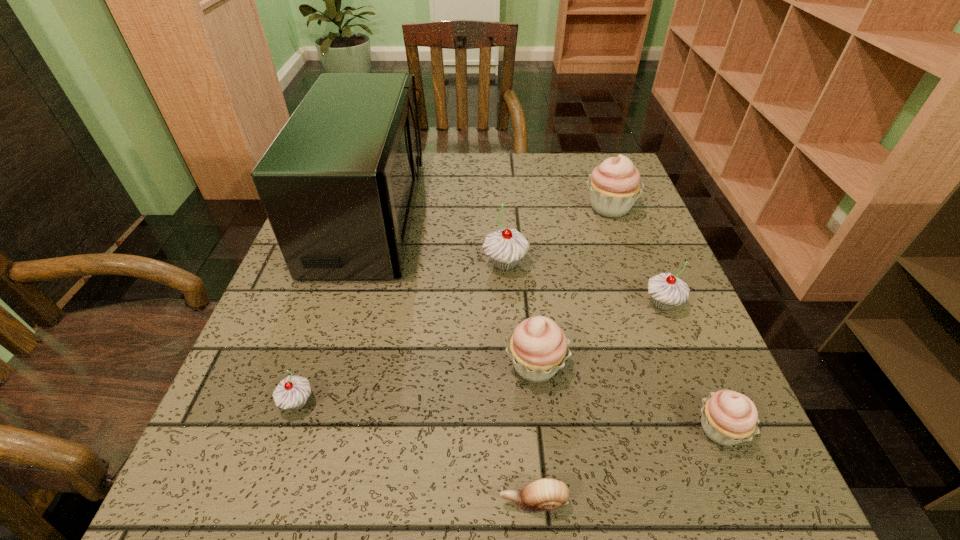
What are the coordinates of `object located at the far left corner` in the screenshot? It's located at (338, 184).

Find the location of a particular element. object at the far right corner is located at coordinates (614, 185).

The image size is (960, 540). In order to click on free space at the far edge of the desktop in this screenshot , I will do `click(486, 166)`.

Locate an element on the screen. This screenshot has height=540, width=960. free point at the left edge is located at coordinates (287, 287).

Where is `free space at the right edge`? This screenshot has height=540, width=960. free space at the right edge is located at coordinates (693, 359).

Image resolution: width=960 pixels, height=540 pixels. In the image, there is a desktop. In order to click on free space at the near left corner in this screenshot , I will do `click(228, 477)`.

Identify the location of free region at the far right corner. Image resolution: width=960 pixels, height=540 pixels. click(591, 168).

Image resolution: width=960 pixels, height=540 pixels. Identify the location of vacant space at the near right corner of the desktop. (691, 468).

Where is `blank region between the second smallest pink cupcake and the third farthest cupcake`? This screenshot has width=960, height=540. blank region between the second smallest pink cupcake and the third farthest cupcake is located at coordinates pyautogui.click(x=599, y=335).

At what (x,y) coordinates should I click in order to perform the action: click on free spot between the nearest gray cupcake and the second farthest pink cupcake. Please return your answer as a coordinate pair (x, y). Looking at the image, I should click on (417, 384).